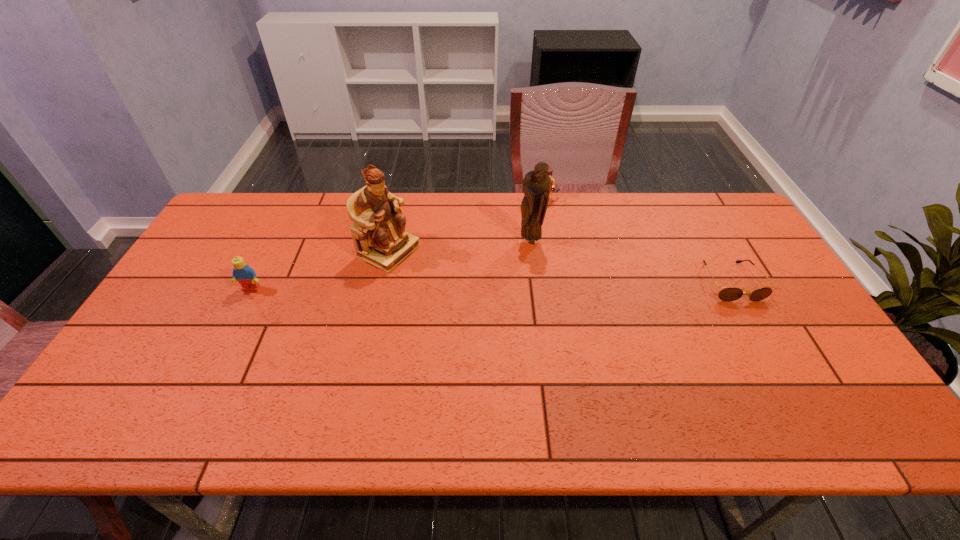
You are a GUI agent. You are given a task and a screenshot of the screen. Output one action in this format:
    pyautogui.click(x=<x>, y=<y>)
    Task: Click on the vacant area that lies between the sunglasses and the left Lego
    This screenshot has width=960, height=540.
    Given the screenshot: What is the action you would take?
    pyautogui.click(x=491, y=286)

Find the location of a particular element. free space that is in between the fourth object from right to left and the farthest object is located at coordinates (465, 226).

Where is `vacant area between the farthest object and the left figurine`? vacant area between the farthest object and the left figurine is located at coordinates (465, 226).

Select which object appears as the second closest to the farther Lego. Please provide its 2D coordinates. Your answer should be formatted as a tuple, i.e. [(x, y)], where the tuple contains the x and y coordinates of a point satisfying the conditions above.

[(378, 232)]

Identify which object is located as the third nearest to the leftmost object. Please provide its 2D coordinates. Your answer should be formatted as a tuple, i.e. [(x, y)], where the tuple contains the x and y coordinates of a point satisfying the conditions above.

[(550, 171)]

You are a GUI agent. You are given a task and a screenshot of the screen. Output one action in this format:
    pyautogui.click(x=<x>, y=<y>)
    Task: Click on the vacant space that satisfies the following two spatial constraints: 1. on the back side of the farthest object; 2. on the left side of the fourth object from right to left
    
    Given the screenshot: What is the action you would take?
    pyautogui.click(x=400, y=200)